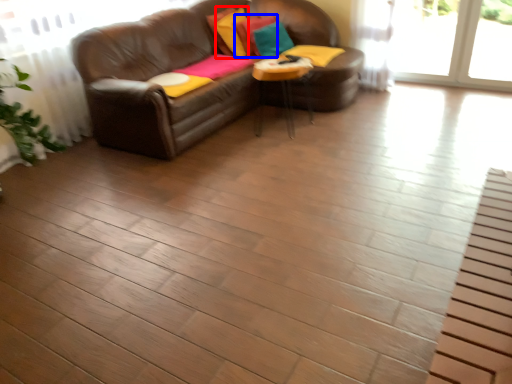
Question: Which object is closer to the camera taking this photo, pillow (highlighted by a red box) or pillow (highlighted by a blue box)?

Choices:
 (A) pillow
 (B) pillow

Answer: (A)